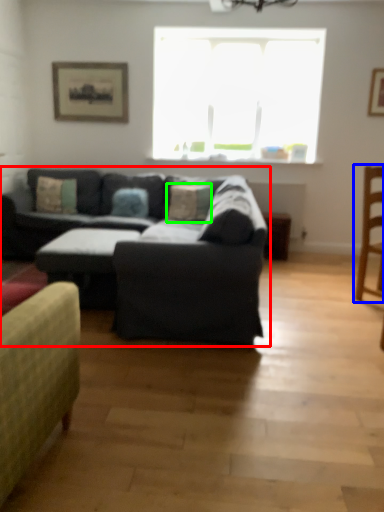
Question: Which object is the closest to the studio couch (highlighted by a red box)? Choose among these: chair (highlighted by a blue box) or pillow (highlighted by a green box).

Choices:
 (A) chair
 (B) pillow

Answer: (A)